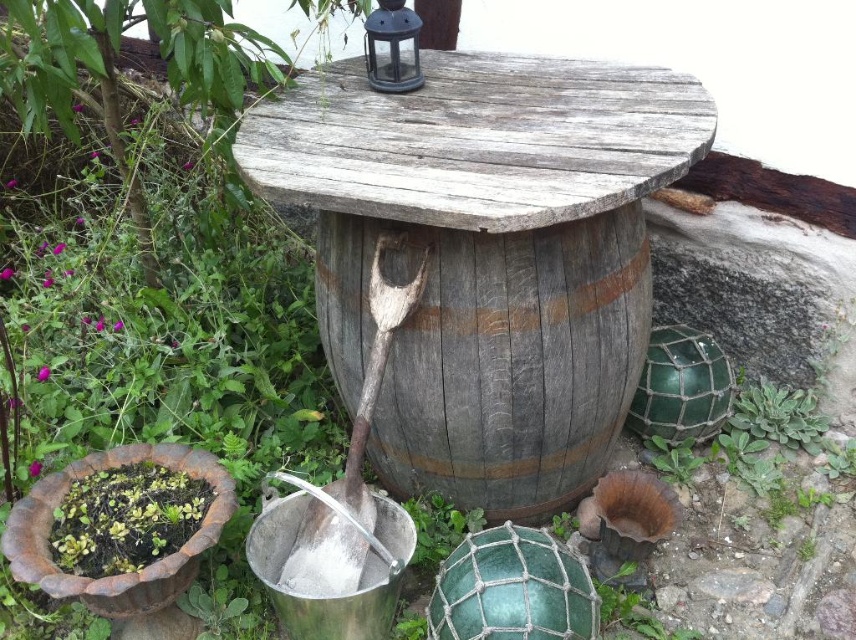
Question: Where is weathered wood barrel at center located in relation to wooden shovel at center in the image?

Choices:
 (A) left
 (B) right

Answer: (B)

Question: Can you confirm if weathered wood barrel at center is positioned to the left of wooden shovel at center?

Choices:
 (A) yes
 (B) no

Answer: (B)

Question: Which of the following is the closest to the observer?

Choices:
 (A) weathered wood barrel at center
 (B) wooden shovel at center

Answer: (B)

Question: Which of the following is the farthest from the observer?

Choices:
 (A) wooden shovel at center
 (B) weathered wood barrel at center

Answer: (B)

Question: Which point is closer to the camera?

Choices:
 (A) (381, 304)
 (B) (613, 232)

Answer: (A)

Question: Is weathered wood barrel at center bigger than wooden shovel at center?

Choices:
 (A) no
 (B) yes

Answer: (B)